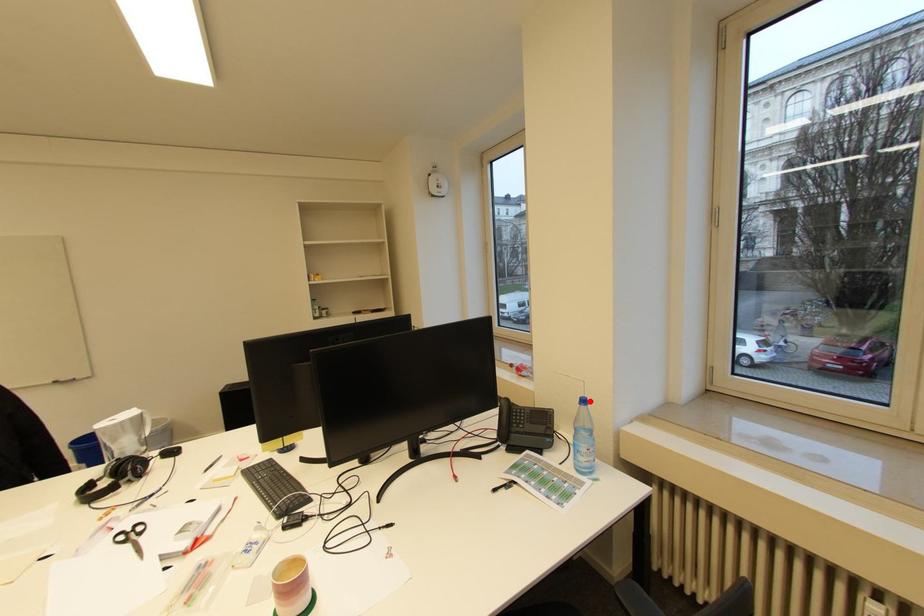
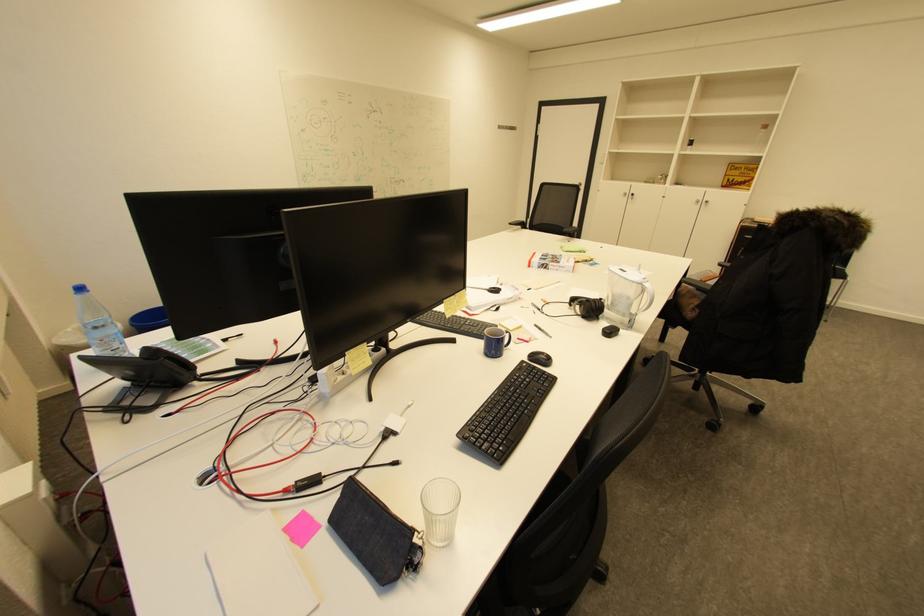
Where in the second image is the point corresponding to the highlighted location from the first image?

(88, 290)